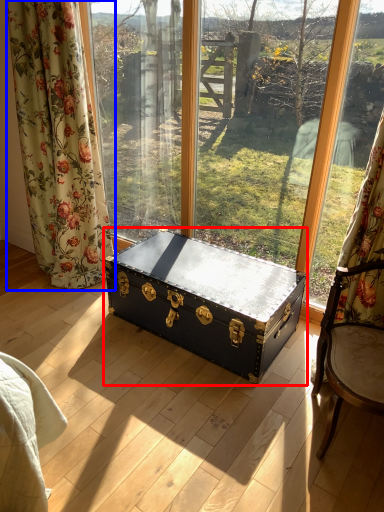
Question: Which object appears farthest to the camera in this image, table (highlighted by a red box) or curtain (highlighted by a blue box)?

Choices:
 (A) table
 (B) curtain

Answer: (B)